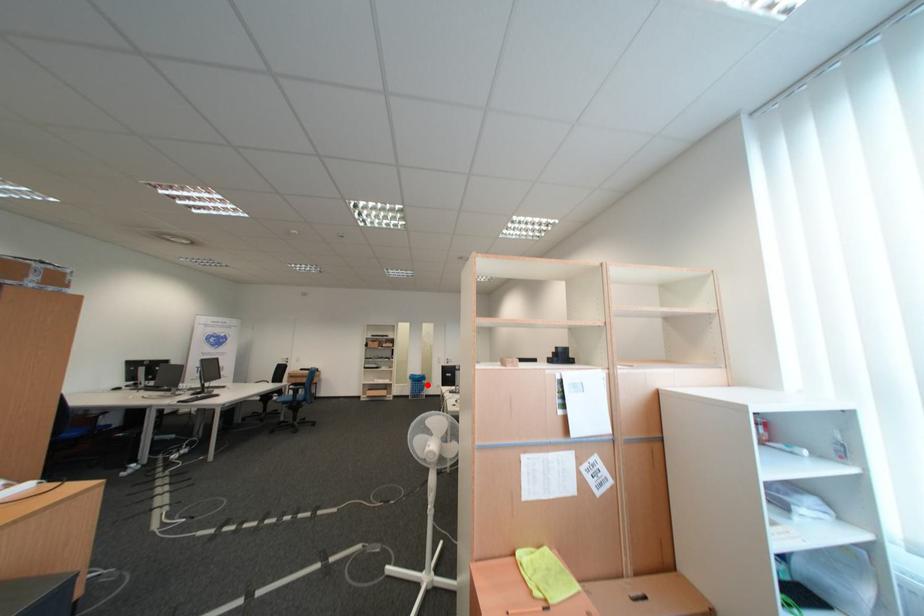
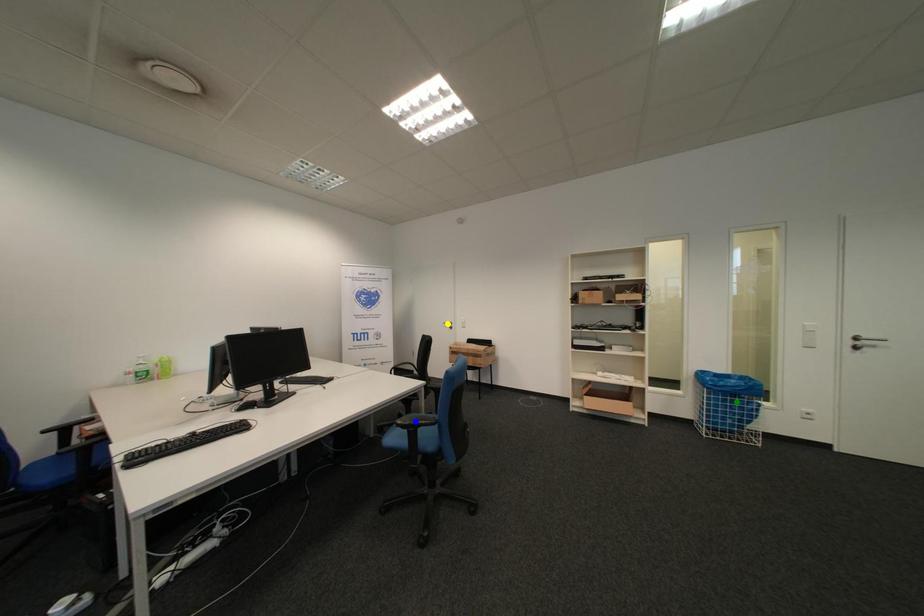
Question: I am providing you with two images of the same scene from different viewpoints. A red point is marked on the first image. You are given multiple points on the second image. Which spot in image 2 lines up with the point in image 1?

Choices:
 (A) yellow point
 (B) green point
 (C) blue point

Answer: (B)